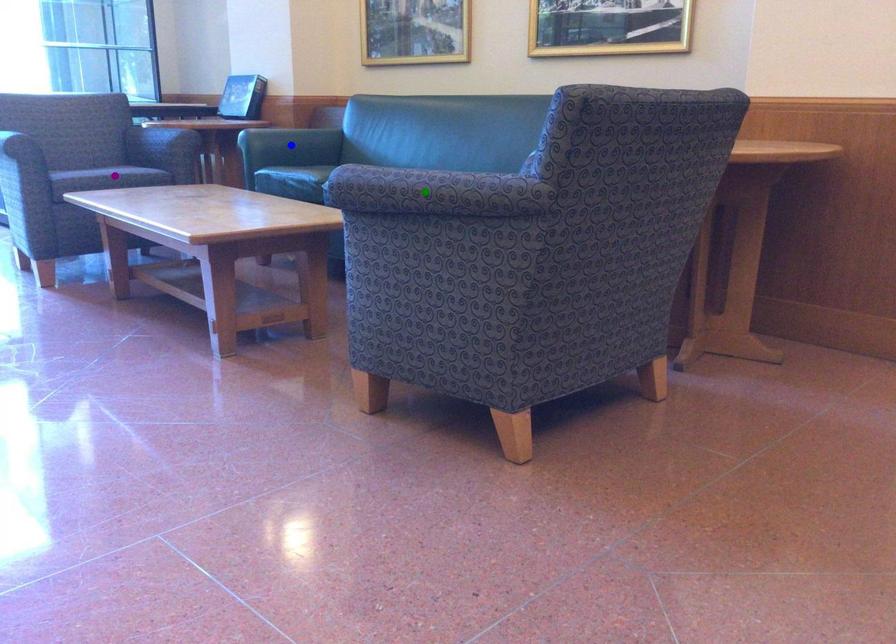
Order these from nearest to farthest:
blue point
green point
purple point

green point, purple point, blue point